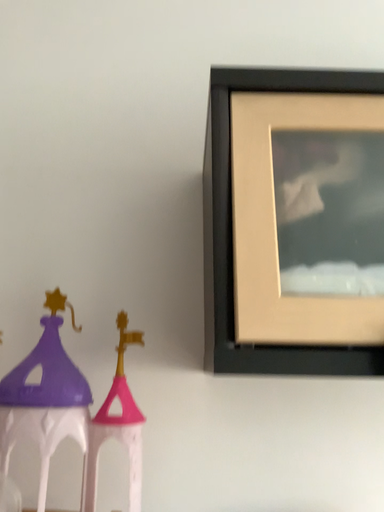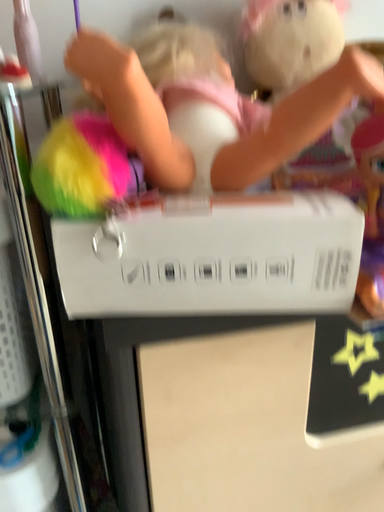
Question: How did the camera likely rotate when shooting the video?

Choices:
 (A) rotated left
 (B) rotated right

Answer: (B)